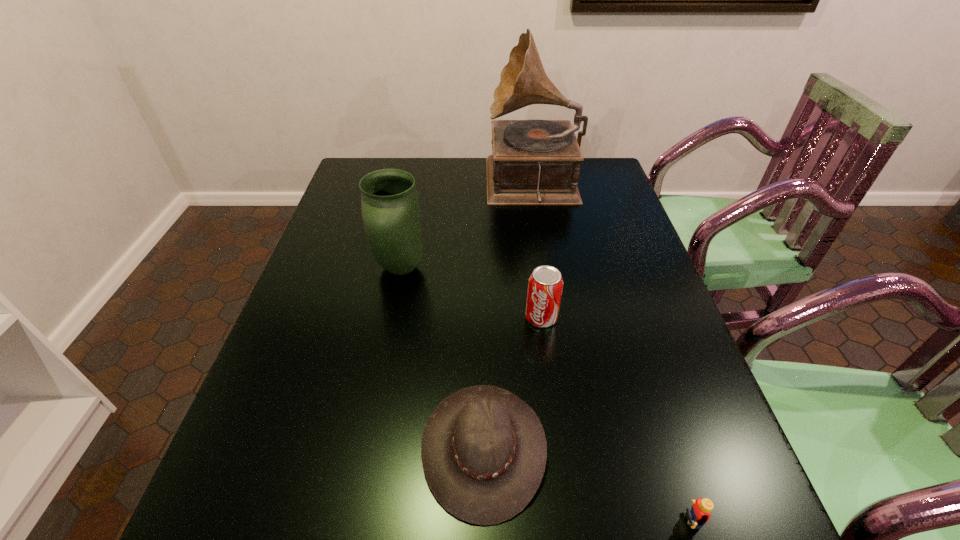
What are the coordinates of `the tallest object` in the screenshot? It's located at click(x=534, y=162).

The image size is (960, 540). I want to click on record player, so click(534, 162).

Identify the location of the leftmost object. This screenshot has width=960, height=540. (390, 208).

Find the location of a particular element. The height and width of the screenshot is (540, 960). vase is located at coordinates (390, 208).

This screenshot has width=960, height=540. Identify the location of the third shortest object. (x=545, y=285).

Find the location of a particular element. Image resolution: width=960 pixels, height=540 pixels. soda can is located at coordinates (545, 285).

Where is `Lego`? This screenshot has height=540, width=960. Lego is located at coordinates (699, 514).

Locate an element on the screen. This screenshot has width=960, height=540. hat is located at coordinates [x=483, y=450].

You are a GUI agent. You are given a task and a screenshot of the screen. Output one action in this format:
    pyautogui.click(x=<x>, y=<y>)
    Task: Click on the vacant region located from the horn of the farthest object
    
    Given the screenshot: What is the action you would take?
    pyautogui.click(x=457, y=186)

This screenshot has width=960, height=540. I want to click on vacant space positioned from the horn of the farthest object, so coord(372,186).